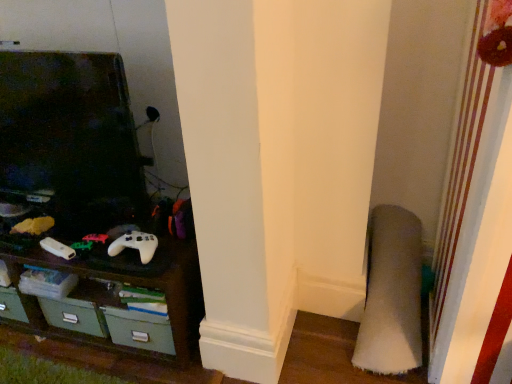
Locate an element on the screen. The height and width of the screenshot is (384, 512). free space to the back side of white matte game controller at lower left, arranged as the 1th game controller when viewed from the left is located at coordinates (65, 232).